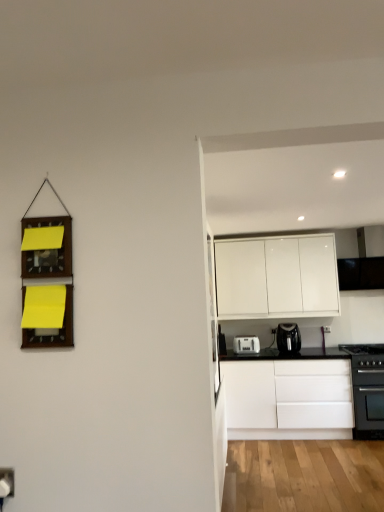
Question: From the image's perspective, is white glossy cabinet at upper right, the 1th cabinetry from the top, positioned above or below black matte gas stove at right?

Choices:
 (A) above
 (B) below

Answer: (A)

Question: Looking at the image, does white glossy cabinet at upper right, which appears as the 2th cabinetry when ordered from the bottom, seem bigger or smaller compared to black matte gas stove at right?

Choices:
 (A) big
 (B) small

Answer: (A)

Question: Which of these objects is positioned closest to the white plastic electric outlet at lower left?

Choices:
 (A) black plastic coffee maker at center, the second kitchen appliance in the left-to-right sequence
 (B) black matte oven at lower right
 (C) white plastic toaster at lower center, the 2th kitchen appliance in the right-to-left sequence
 (D) white glossy cabinet at upper right, which appears as the 2th cabinetry when ordered from the bottom
 (E) black matte gas stove at right

Answer: (C)

Question: Considering the real-world distances, which object is farthest from the white plastic toaster at lower center, the 2th kitchen appliance in the right-to-left sequence?

Choices:
 (A) white matte cabinet at right, placed as the 2th cabinetry when sorted from top to bottom
 (B) white plastic electric outlet at lower left
 (C) white glossy cabinet at upper right, which appears as the 2th cabinetry when ordered from the bottom
 (D) black matte gas stove at right
 (E) black plastic coffee maker at center, the second kitchen appliance in the left-to-right sequence

Answer: (B)